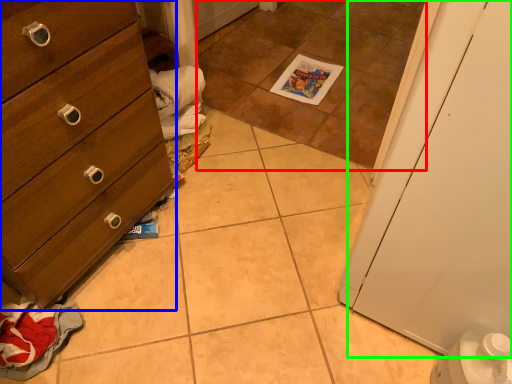
Question: Which object is the closest to the tile (highlighted by a red box)? Choose among these: chest of drawers (highlighted by a blue box) or door (highlighted by a green box).

Choices:
 (A) chest of drawers
 (B) door

Answer: (A)